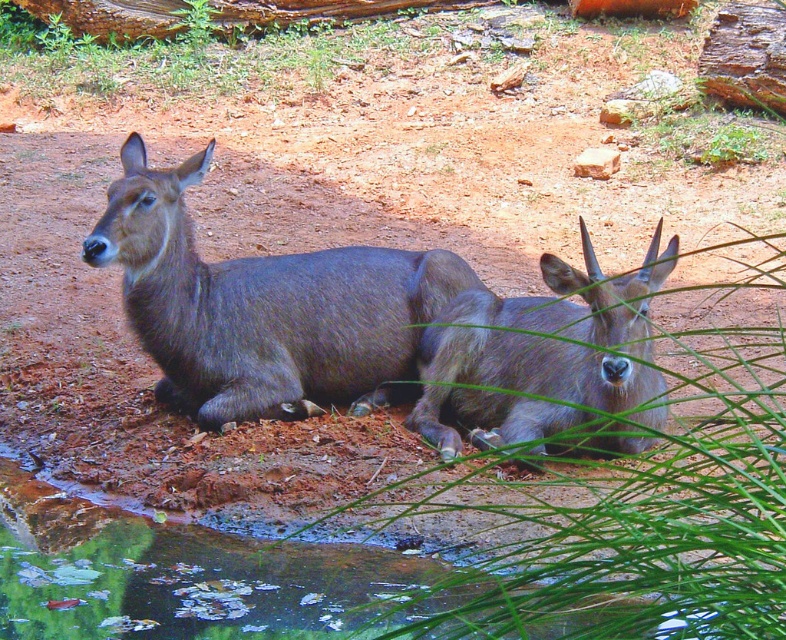
Question: Which point is closer to the camera?

Choices:
 (A) (546, 323)
 (B) (685, 584)

Answer: (B)

Question: Does green leafy grass at center lie in front of shiny brown deer at center?

Choices:
 (A) yes
 (B) no

Answer: (A)

Question: Considering the real-world distances, which object is closest to the shiny brown deer at center?

Choices:
 (A) green leafy grass at center
 (B) gray matte deer at center

Answer: (B)

Question: Which of the following is the closest to the observer?

Choices:
 (A) (542, 308)
 (B) (274, 349)

Answer: (A)

Question: Can you confirm if green leafy grass at center is smaller than gray matte deer at center?

Choices:
 (A) no
 (B) yes

Answer: (A)

Question: Can you confirm if green leafy grass at center is bigger than gray matte deer at center?

Choices:
 (A) yes
 (B) no

Answer: (A)